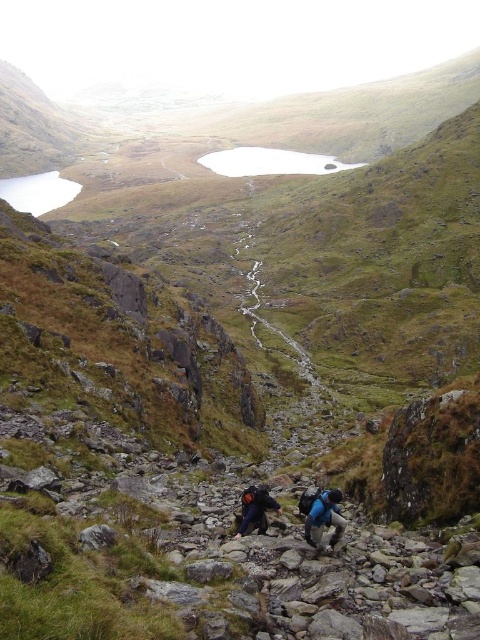
The height and width of the screenshot is (640, 480). What are the coordinates of `blue fabric backpacks at center` in the screenshot? It's located at (321, 515).

Is the position of blue fabric backpacks at center more distant than that of blue fabric backpack at lower center?

Yes, it is.

At what (x,y) coordinates should I click in order to perform the action: click on blue fabric backpacks at center. Please return your answer as a coordinate pair (x, y). The height and width of the screenshot is (640, 480). Looking at the image, I should click on (x=321, y=515).

Does clear water at center appear over blue fabric backpack at lower center?

Yes, clear water at center is above blue fabric backpack at lower center.

Which is behind, point (223, 154) or point (328, 497)?

Positioned behind is point (223, 154).

Which is in front, point (226, 170) or point (332, 536)?

Positioned in front is point (332, 536).

Locate an element on the screen. This screenshot has width=480, height=640. clear water at center is located at coordinates (271, 163).

Is blue fabric backpack at lower center shorter than dark blue backpack at center?

In fact, blue fabric backpack at lower center may be taller than dark blue backpack at center.

Image resolution: width=480 pixels, height=640 pixels. What do you see at coordinates (324, 516) in the screenshot?
I see `blue fabric backpack at lower center` at bounding box center [324, 516].

Between point (344, 522) and point (264, 524), which one is positioned behind?

Positioned behind is point (264, 524).

Where is `blue fabric backpack at lower center`? The image size is (480, 640). blue fabric backpack at lower center is located at coordinates (324, 516).